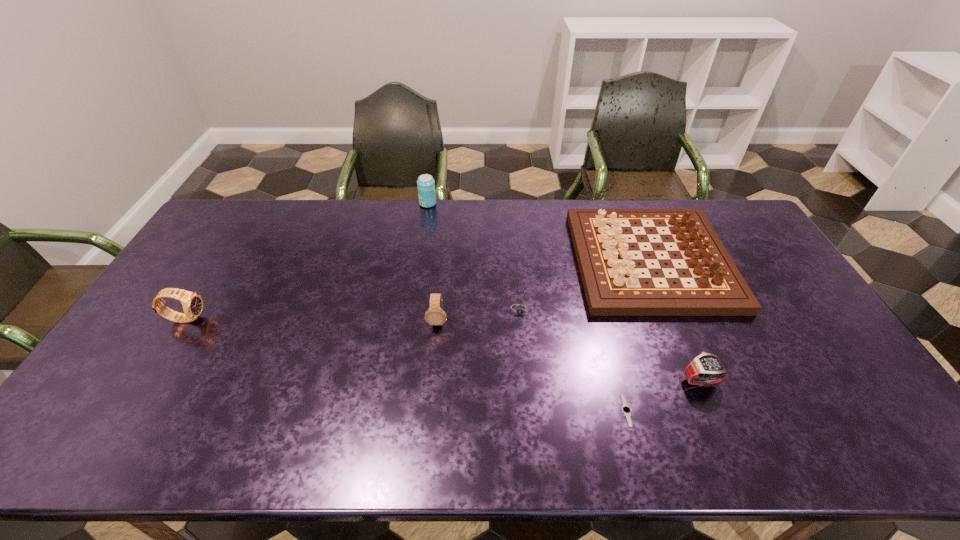
Where is `the farthest object`? The image size is (960, 540). the farthest object is located at coordinates (426, 185).

The image size is (960, 540). I want to click on the sixth object from right to left, so click(426, 185).

Image resolution: width=960 pixels, height=540 pixels. I want to click on gameboard, so click(x=605, y=248).

Locate an element on the screen. the leftmost watch is located at coordinates (192, 303).

This screenshot has width=960, height=540. Find the location of `the second watch from left to right`. the second watch from left to right is located at coordinates (435, 316).

Locate an element on the screen. The height and width of the screenshot is (540, 960). the fourth farthest watch is located at coordinates (706, 369).

Identify the location of the second nearest object. The width and height of the screenshot is (960, 540). [x=706, y=369].

Where is `the fourth tallest watch`? the fourth tallest watch is located at coordinates (519, 310).

Locate an element on the screen. The height and width of the screenshot is (540, 960). the sixth tallest object is located at coordinates (519, 310).

Where is `the nearest object`? The image size is (960, 540). the nearest object is located at coordinates (626, 410).